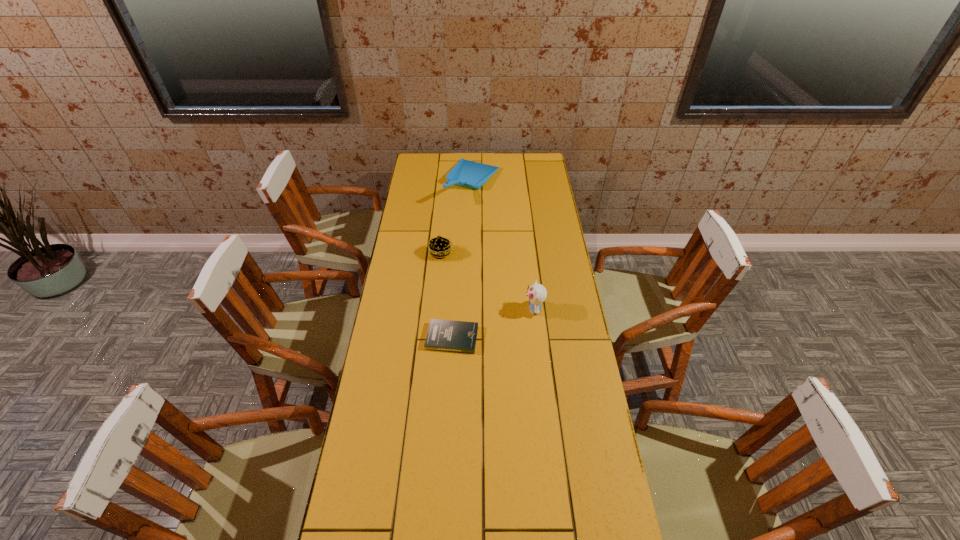
Identify the location of vacant region located 0.180m on the front-facing side of the second nearest object. Image resolution: width=960 pixels, height=540 pixels. (478, 309).

Find the location of a particular element. vacant region located on the front of the third tallest object is located at coordinates (439, 275).

Where is `vacant region located on the front of the nearest object`? This screenshot has height=540, width=960. vacant region located on the front of the nearest object is located at coordinates (450, 374).

I want to click on object positioned at the far edge, so click(469, 174).

Find the location of `object located at the left edge`. object located at the left edge is located at coordinates (439, 247).

I want to click on object situated at the right edge, so click(537, 293).

What are the coordinates of `vacant area at the far edge of the desktop` in the screenshot? It's located at (499, 163).

Where is `vacant space at the left edge of the desktop`? The height and width of the screenshot is (540, 960). vacant space at the left edge of the desktop is located at coordinates (393, 333).

Identify the location of free space at the right edge of the desktop. The image size is (960, 540). (540, 192).

In the image, there is a desktop. Where is `free space at the far left corner`? The width and height of the screenshot is (960, 540). free space at the far left corner is located at coordinates (428, 174).